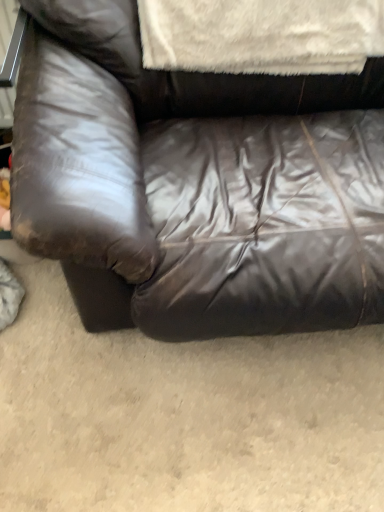
This screenshot has height=512, width=384. Find the location of `shiny brown leather couch at center`. shiny brown leather couch at center is located at coordinates (199, 180).

The width and height of the screenshot is (384, 512). What do you see at coordinates (199, 180) in the screenshot?
I see `shiny brown leather couch at center` at bounding box center [199, 180].

In order to click on white fluffy blanket at upper center in this screenshot , I will do `click(261, 35)`.

This screenshot has height=512, width=384. What do you see at coordinates (261, 35) in the screenshot?
I see `white fluffy blanket at upper center` at bounding box center [261, 35].

At what (x,y) coordinates should I click in order to perform the action: click on shiny brown leather couch at center. Please return your answer as a coordinate pair (x, y). Looking at the image, I should click on (199, 180).

Between shiny brown leather couch at center and white fluffy blanket at upper center, which one appears on the right side from the viewer's perspective?

shiny brown leather couch at center.

Is shiny brown leather couch at center further to the viewer compared to white fluffy blanket at upper center?

That is False.

Which is closer, (132,71) or (196,14)?

Point (132,71) appears to be closer to the viewer than point (196,14).

From the image's perspective, which is below, shiny brown leather couch at center or white fluffy blanket at upper center?

shiny brown leather couch at center.

In the scene shown: From a real-world perspective, relative to white fluffy blanket at upper center, is shiny brown leather couch at center vertically above or below?

shiny brown leather couch at center is situated lower than white fluffy blanket at upper center in the real world.

Considering the relative sizes of shiny brown leather couch at center and white fluffy blanket at upper center in the image provided, is shiny brown leather couch at center wider than white fluffy blanket at upper center?

Correct, the width of shiny brown leather couch at center exceeds that of white fluffy blanket at upper center.

Is shiny brown leather couch at center taller or shorter than white fluffy blanket at upper center?

Clearly, shiny brown leather couch at center is taller compared to white fluffy blanket at upper center.

Can you confirm if shiny brown leather couch at center is smaller than white fluffy blanket at upper center?

No.

Looking at this image, is shiny brown leather couch at center situated inside white fluffy blanket at upper center or outside?

shiny brown leather couch at center is outside white fluffy blanket at upper center.

Is shiny brown leather couch at center with white fluffy blanket at upper center?

shiny brown leather couch at center and white fluffy blanket at upper center are clearly separated.

Could you tell me if shiny brown leather couch at center is facing white fluffy blanket at upper center?

Yes, shiny brown leather couch at center faces towards white fluffy blanket at upper center.

In the image, there is a white fluffy blanket at upper center. At what (x,y) coordinates should I click in order to perform the action: click on studio couch below it (from a real-world perspective). Please return your answer as a coordinate pair (x, y). The height and width of the screenshot is (512, 384). Looking at the image, I should click on (199, 180).

Would you say white fluffy blanket at upper center is to the left or to the right of shiny brown leather couch at center in the picture?

white fluffy blanket at upper center is positioned on shiny brown leather couch at center's left side.

Which object is closer to the camera, white fluffy blanket at upper center or shiny brown leather couch at center?

shiny brown leather couch at center is closer to the camera.

Does point (315, 9) lie in front of point (259, 79)?

Yes.

From the image's perspective, which object appears higher, white fluffy blanket at upper center or shiny brown leather couch at center?

white fluffy blanket at upper center.

From a real-world perspective, which is physically below, white fluffy blanket at upper center or shiny brown leather couch at center?

shiny brown leather couch at center is physically lower.

Does white fluffy blanket at upper center have a lesser width compared to shiny brown leather couch at center?

Indeed, white fluffy blanket at upper center has a lesser width compared to shiny brown leather couch at center.

Which of these two, white fluffy blanket at upper center or shiny brown leather couch at center, stands shorter?

Standing shorter between the two is white fluffy blanket at upper center.

Does white fluffy blanket at upper center have a smaller size compared to shiny brown leather couch at center?

Correct, white fluffy blanket at upper center occupies less space than shiny brown leather couch at center.

Choose the correct answer: Is white fluffy blanket at upper center inside shiny brown leather couch at center or outside it?

white fluffy blanket at upper center fits inside shiny brown leather couch at center.

Based on the photo, is the surface of white fluffy blanket at upper center in direct contact with shiny brown leather couch at center?

white fluffy blanket at upper center and shiny brown leather couch at center are clearly separated.

Is white fluffy blanket at upper center facing towards shiny brown leather couch at center?

Yes, white fluffy blanket at upper center is turned towards shiny brown leather couch at center.

Looking at this image, measure the distance between white fluffy blanket at upper center and shiny brown leather couch at center.

white fluffy blanket at upper center and shiny brown leather couch at center are 24.44 centimeters apart from each other.

The height and width of the screenshot is (512, 384). I want to click on studio couch located below the white fluffy blanket at upper center (from the image's perspective), so click(199, 180).

In the image, there is a white fluffy blanket at upper center. Identify the location of studio couch below it (from the image's perspective). (199, 180).

In order to click on studio couch below the white fluffy blanket at upper center (from a real-world perspective) in this screenshot , I will do `click(199, 180)`.